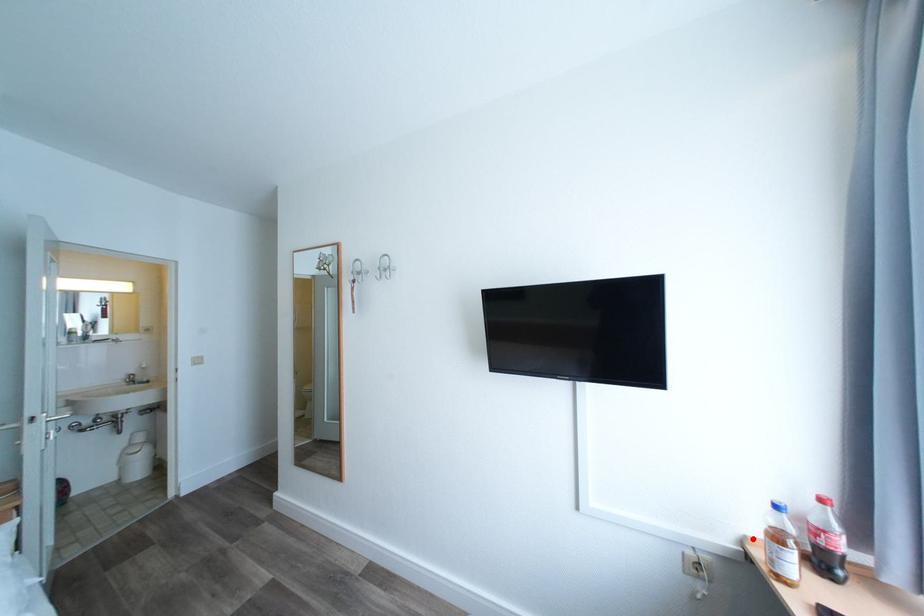
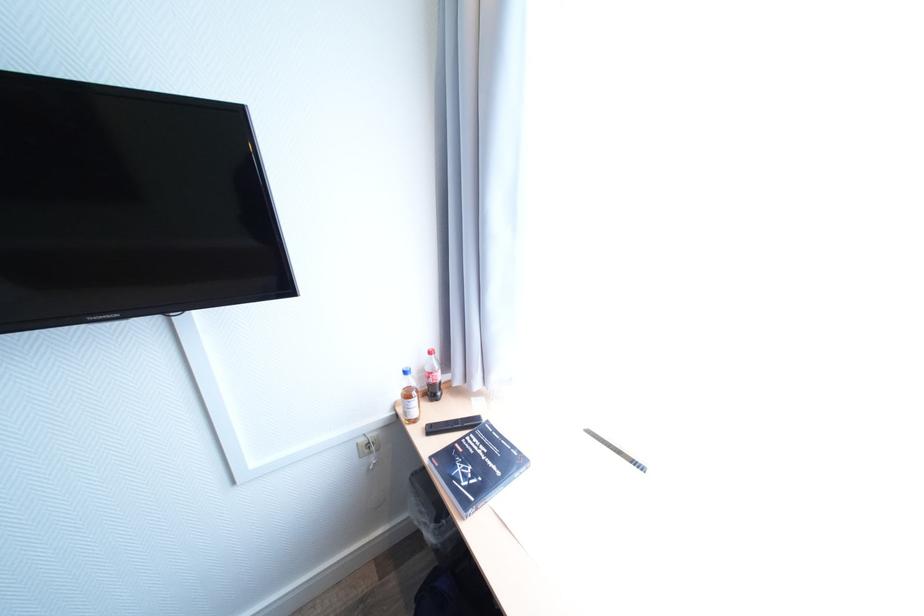
Find the pixel in the second image that matches the highlighted location in the first image.

(403, 403)